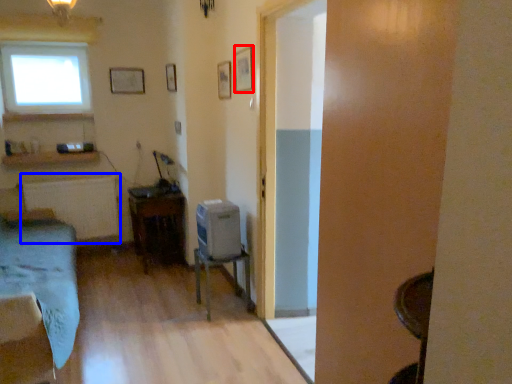
Question: Among these objects, which one is nearest to the camera, picture frame (highlighted by a red box) or radiator (highlighted by a blue box)?

Choices:
 (A) picture frame
 (B) radiator

Answer: (A)